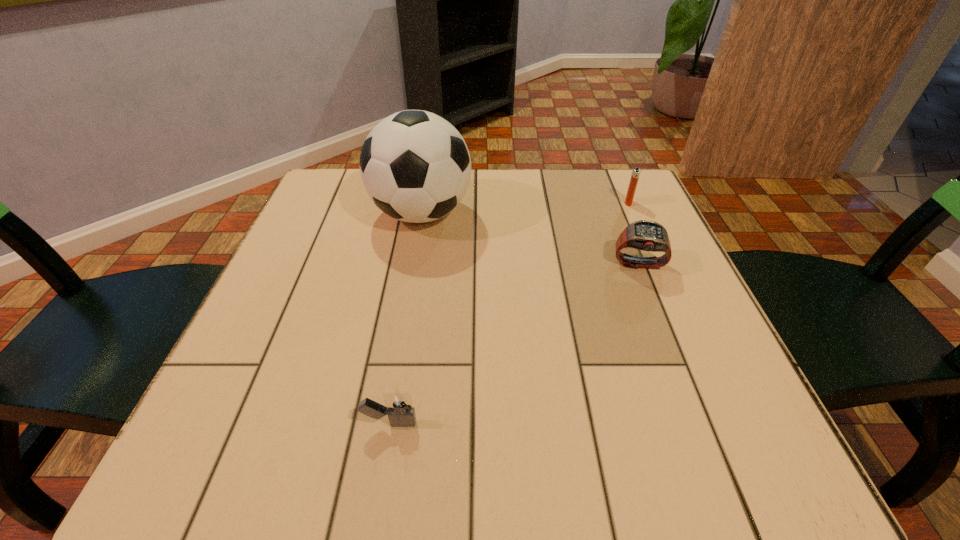
Where is `soccer ball`? This screenshot has height=540, width=960. soccer ball is located at coordinates (415, 166).

I want to click on the right igniter, so click(635, 174).

Identify the location of the second nearest object. The image size is (960, 540). (646, 235).

The width and height of the screenshot is (960, 540). In order to click on the left igniter in this screenshot , I will do `click(398, 406)`.

Identify the location of the nearest object. (398, 406).

Identify the location of vacant region located 0.140m on the front of the soccer ball. This screenshot has width=960, height=540. (408, 290).

Find the location of a particular element. This screenshot has height=540, width=960. vacant space located on the front of the farther igniter is located at coordinates (683, 325).

Where is `blank space located 0.340m on the left of the second nearest object`? blank space located 0.340m on the left of the second nearest object is located at coordinates (449, 265).

This screenshot has width=960, height=540. I want to click on free location located 0.250m on the back of the left igniter, so click(411, 294).

Identify the location of soccer ball that is at the far edge. The height and width of the screenshot is (540, 960). (415, 166).